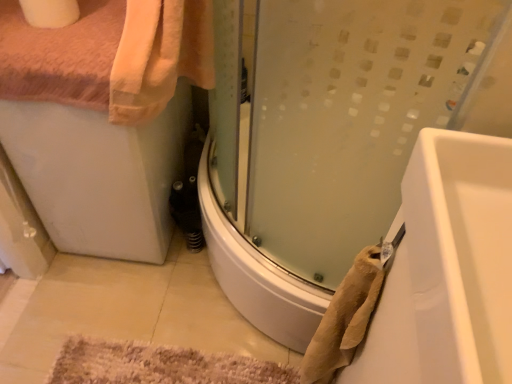
Image resolution: width=512 pixels, height=384 pixels. Find the location of `empty space that is to the right of white matte toilet paper at upper left`. empty space that is to the right of white matte toilet paper at upper left is located at coordinates (102, 20).